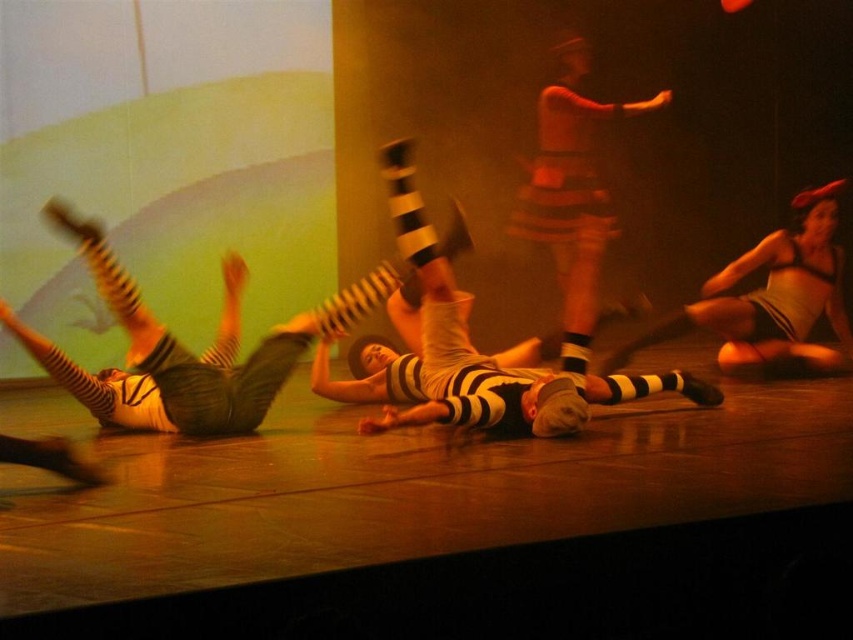
Question: Is striped fabric dancer at center smaller than matte white swimsuit at right?

Choices:
 (A) no
 (B) yes

Answer: (A)

Question: Can you confirm if striped fabric dancer at center is positioned above matte white swimsuit at right?

Choices:
 (A) no
 (B) yes

Answer: (A)

Question: Is white striped socks at center smaller than matte white swimsuit at right?

Choices:
 (A) no
 (B) yes

Answer: (A)

Question: Which point is closer to the camera?

Choices:
 (A) white striped socks at center
 (B) striped fabric dancer at center

Answer: (B)

Question: Which point is closer to the camera?

Choices:
 (A) (387, 172)
 (B) (155, 326)

Answer: (A)

Question: Based on their relative distances, which object is nearer to the white striped socks at center?

Choices:
 (A) striped fabric dancer at center
 (B) matte white swimsuit at right

Answer: (A)